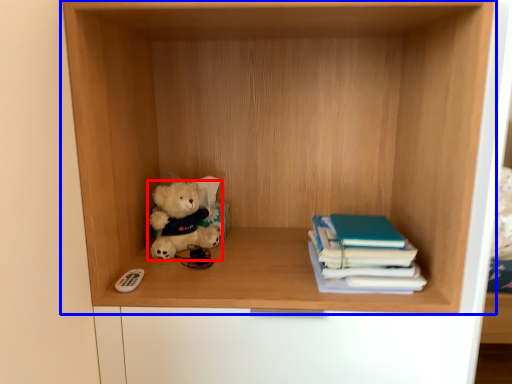
Question: Which point is further to the camera, teddy bear (highlighted by a red box) or shelf (highlighted by a blue box)?

Choices:
 (A) teddy bear
 (B) shelf

Answer: (A)